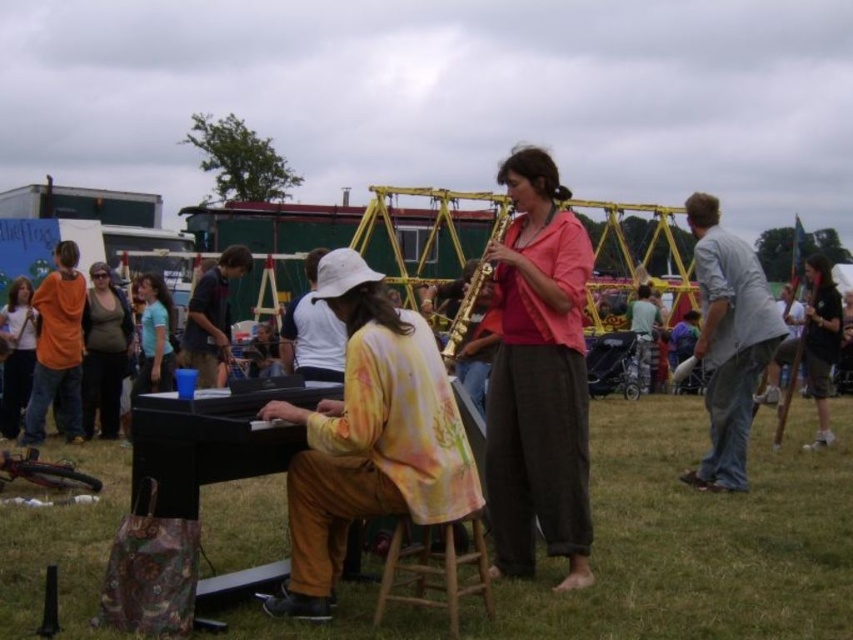
Question: Considering the relative positions of gray cotton shirt at right and orange cotton shirt at left in the image provided, where is gray cotton shirt at right located with respect to orange cotton shirt at left?

Choices:
 (A) right
 (B) left

Answer: (A)

Question: Can you confirm if pink fabric shirt at center is positioned above light blue shirt at center?

Choices:
 (A) no
 (B) yes

Answer: (A)

Question: Can you confirm if gray cotton shirt at right is positioned above wooden stool at center?

Choices:
 (A) yes
 (B) no

Answer: (A)

Question: Which object is the farthest from the black cotton t-shirt at right?

Choices:
 (A) yellow floral blouse at center
 (B) white cotton hat at center
 (C) black polished piano at center
 (D) floral silk shirt at center

Answer: (C)

Question: Which of the following is the closest to the observer?

Choices:
 (A) matte black shirt at center
 (B) pink fabric shirt at center
 (C) orange cotton shirt at left

Answer: (B)

Question: Among these objects, which one is farthest from the camera?

Choices:
 (A) yellow floral blouse at center
 (B) pink fabric shirt at center
 (C) wooden stool at center

Answer: (A)